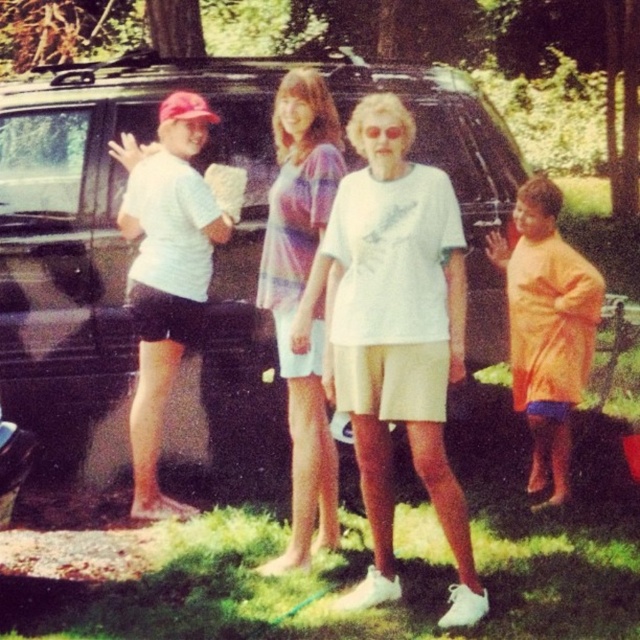
Question: Which object appears farthest from the camera in this image?

Choices:
 (A) orange cotton shirt at right
 (B) matte black minivan at center
 (C) striped cotton shirt at center
 (D) white matte t-shirt at center

Answer: (B)

Question: Is matte black minivan at center behind striped cotton shirt at center?

Choices:
 (A) no
 (B) yes

Answer: (B)

Question: Which point is closer to the camera?

Choices:
 (A) (552, 298)
 (B) (58, 444)
 (C) (458, 339)
 (D) (292, 460)

Answer: (C)

Question: Estimate the real-world distances between objects in this image. Which object is closer to the orange cotton shirt at right?

Choices:
 (A) matte black minivan at center
 (B) striped cotton shirt at center
 (C) white matte t-shirt at center

Answer: (C)

Question: Does striped cotton shirt at center have a lesser width compared to orange cotton shirt at right?

Choices:
 (A) no
 (B) yes

Answer: (B)

Question: In this image, where is matte black minivan at center located relative to white matte t-shirt at center?

Choices:
 (A) right
 (B) left

Answer: (B)